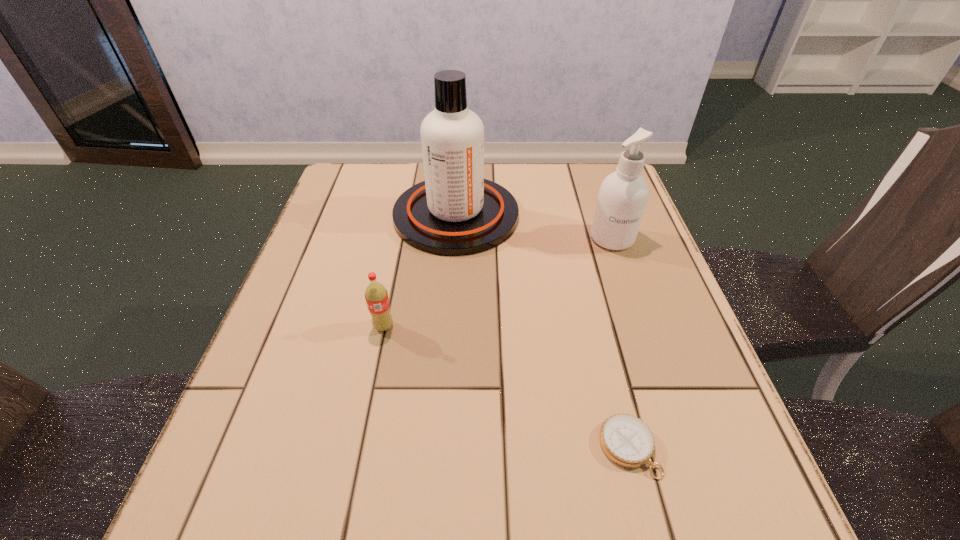
Image resolution: width=960 pixels, height=540 pixels. In order to click on blank region between the nearest object and the second tallest object in this screenshot , I will do `click(620, 343)`.

Image resolution: width=960 pixels, height=540 pixels. Find the location of `unoccupied position between the shortest object and the shorter cleansing agent`. unoccupied position between the shortest object and the shorter cleansing agent is located at coordinates (620, 343).

What are the coordinates of `free space between the left cleansing agent and the third tallest object` in the screenshot? It's located at (420, 271).

Identify which object is the second closest to the soda. Please provide its 2D coordinates. Your answer should be formatted as a tuple, i.e. [(x, y)], where the tuple contains the x and y coordinates of a point satisfying the conditions above.

[(626, 440)]

Identify which object is the nearest to the shorter cleansing agent. Please provide its 2D coordinates. Your answer should be formatted as a tuple, i.e. [(x, y)], where the tuple contains the x and y coordinates of a point satisfying the conditions above.

[(455, 212)]